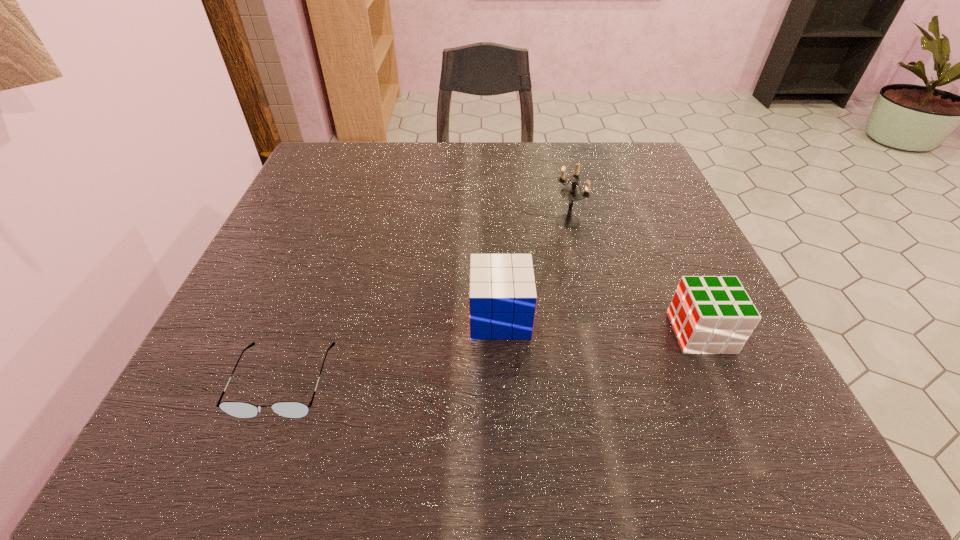
Identify the location of the second closest object relative to the right cube. (572, 193).

At what (x,y) coordinates should I click in order to perform the action: click on object that is the closest one to the leftmost object. Please return your answer as a coordinate pair (x, y). The image size is (960, 540). Looking at the image, I should click on (502, 297).

Identify the location of blank space that satisfies the following two spatial constraints: 1. on the red face of the right cube; 2. on the lenses of the spectacles. (723, 381).

The image size is (960, 540). Find the location of `vacant region that satisfies the following two spatial constraints: 1. on the red face of the right cube; 2. on the lenses of the shortest object`. vacant region that satisfies the following two spatial constraints: 1. on the red face of the right cube; 2. on the lenses of the shortest object is located at coordinates (723, 381).

The height and width of the screenshot is (540, 960). Find the location of `vacant space that satisfies the following two spatial constraints: 1. on the red face of the rightmost object; 2. on the lenses of the leftmost object`. vacant space that satisfies the following two spatial constraints: 1. on the red face of the rightmost object; 2. on the lenses of the leftmost object is located at coordinates (723, 381).